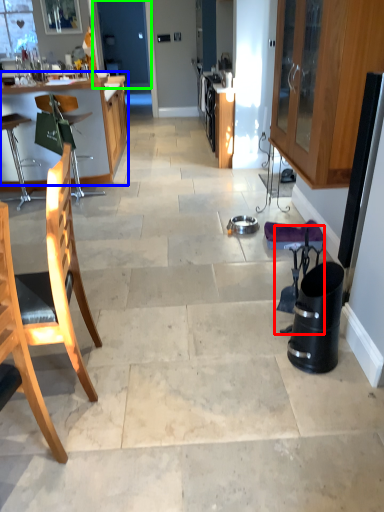
Question: Which object is the farthest from swivel chair (highlighted by a red box)? Choose among these: table (highlighted by a blue box) or screen door (highlighted by a green box).

Choices:
 (A) table
 (B) screen door

Answer: (B)